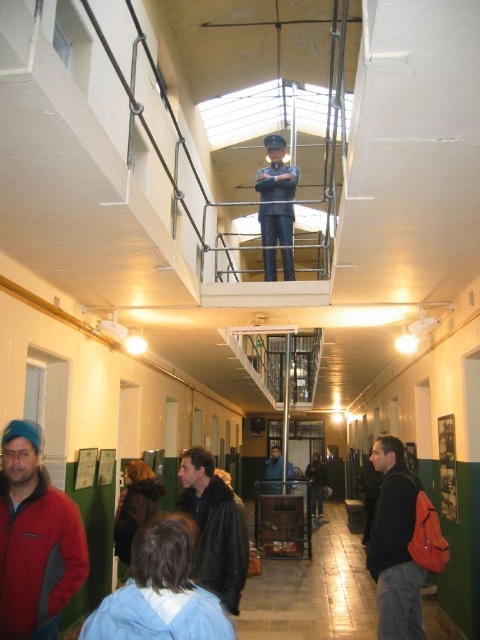
You are a tour guide in the historical prison. You notice two visitors wearing the brushed red jacket at lower left and the dark blue uniform at center. Which visitor is wearing a larger clothing item?

The brushed red jacket at lower left is larger in size than the dark blue uniform at center.

You are a tour guide leading a group through this historical prison corridor. You notice two visitors wearing the matte black jacket at lower right and the dark blue uniform at center. You need to seat them in a row of benches that are exactly 1.2 meters wide. Can both visitors sit side by side without exceeding the bench width?

The matte black jacket at lower right might be wider than dark blue uniform at center. If the jacket is wider, their combined width could exceed the 1.2 meter bench. It is uncertain if they can sit side by side without exceeding the bench width.